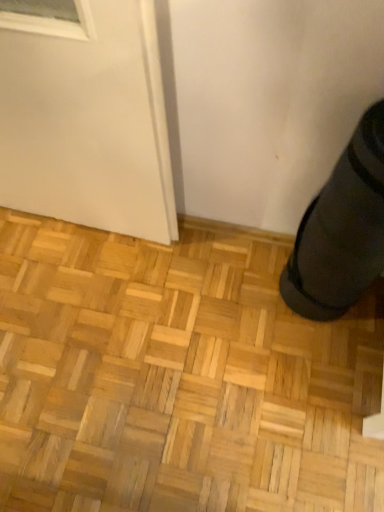
This screenshot has width=384, height=512. Describe the element at coordinates (341, 230) in the screenshot. I see `black rubber shoe at lower right` at that location.

Image resolution: width=384 pixels, height=512 pixels. Identify the location of black rubber shoe at lower right. (341, 230).

Locate an element on the screen. The width and height of the screenshot is (384, 512). natural wood parquet floor at lower right is located at coordinates (178, 377).

Measure the distance between point [130,278] and camera.

They are 1.26 meters apart.

This screenshot has height=512, width=384. What do you see at coordinates (178, 377) in the screenshot? I see `natural wood parquet floor at lower right` at bounding box center [178, 377].

The width and height of the screenshot is (384, 512). I want to click on black rubber shoe at lower right, so click(341, 230).

Consider the image. Is natural wood parquet floor at lower right at the right side of black rubber shoe at lower right?

In fact, natural wood parquet floor at lower right is to the left of black rubber shoe at lower right.

Considering the positions of objects natural wood parquet floor at lower right and black rubber shoe at lower right in the image provided, who is in front, natural wood parquet floor at lower right or black rubber shoe at lower right?

black rubber shoe at lower right is closer to the camera.

Is point (316, 343) in front of point (324, 256)?

No, it is not.

From the image's perspective, between natural wood parquet floor at lower right and black rubber shoe at lower right, who is located below?

natural wood parquet floor at lower right is shown below in the image.

From a real-world perspective, who is located higher, natural wood parquet floor at lower right or black rubber shoe at lower right?

In real-world perspective, black rubber shoe at lower right is above.

Between natural wood parquet floor at lower right and black rubber shoe at lower right, which one has smaller width?

black rubber shoe at lower right is thinner.

Is natural wood parquet floor at lower right taller than black rubber shoe at lower right?

Incorrect, the height of natural wood parquet floor at lower right is not larger of that of black rubber shoe at lower right.

Can you confirm if natural wood parquet floor at lower right is smaller than black rubber shoe at lower right?

Incorrect, natural wood parquet floor at lower right is not smaller in size than black rubber shoe at lower right.

Is black rubber shoe at lower right inside natural wood parquet floor at lower right?

Actually, black rubber shoe at lower right is outside natural wood parquet floor at lower right.

Is natural wood parquet floor at lower right next to black rubber shoe at lower right and touching it?

No, natural wood parquet floor at lower right is not with black rubber shoe at lower right.

Is natural wood parquet floor at lower right looking in the opposite direction of black rubber shoe at lower right?

No, natural wood parquet floor at lower right is not facing away from black rubber shoe at lower right.

How different are the orientations of natural wood parquet floor at lower right and black rubber shoe at lower right in degrees?

They differ by 90.1 degrees in their facing directions.

Image resolution: width=384 pixels, height=512 pixels. In order to click on hardwood on the left of black rubber shoe at lower right in this screenshot , I will do `click(178, 377)`.

Considering the relative positions of black rubber shoe at lower right and natural wood parquet floor at lower right in the image provided, is black rubber shoe at lower right to the left of natural wood parquet floor at lower right from the viewer's perspective?

No.

From the picture: Is black rubber shoe at lower right in front of or behind natural wood parquet floor at lower right in the image?

In the image, black rubber shoe at lower right appears in front of natural wood parquet floor at lower right.

Is point (353, 244) positioned before point (235, 286)?

Yes, it is.

From the image's perspective, is black rubber shoe at lower right located beneath natural wood parquet floor at lower right?

No, from the image's perspective, black rubber shoe at lower right is not below natural wood parquet floor at lower right.

From a real-world perspective, which is physically below, black rubber shoe at lower right or natural wood parquet floor at lower right?

natural wood parquet floor at lower right.

Which object is wider, black rubber shoe at lower right or natural wood parquet floor at lower right?

Wider between the two is natural wood parquet floor at lower right.

Is black rubber shoe at lower right shorter than natural wood parquet floor at lower right?

No, black rubber shoe at lower right is not shorter than natural wood parquet floor at lower right.

Is black rubber shoe at lower right bigger or smaller than natural wood parquet floor at lower right?

In the image, black rubber shoe at lower right appears to be smaller than natural wood parquet floor at lower right.

Is black rubber shoe at lower right completely or partially outside of natural wood parquet floor at lower right?

That's correct, black rubber shoe at lower right is outside of natural wood parquet floor at lower right.

Would you consider black rubber shoe at lower right to be distant from natural wood parquet floor at lower right?

black rubber shoe at lower right is actually quite close to natural wood parquet floor at lower right.

Could you tell me if black rubber shoe at lower right is turned towards natural wood parquet floor at lower right?

No.

Looking at this image, measure the distance between black rubber shoe at lower right and natural wood parquet floor at lower right.

The distance of black rubber shoe at lower right from natural wood parquet floor at lower right is 15.14 inches.

Locate an element on the screen. The height and width of the screenshot is (512, 384). shoe in front of the natural wood parquet floor at lower right is located at coordinates (341, 230).

In the image, there is a black rubber shoe at lower right. At what (x,y) coordinates should I click in order to perform the action: click on hardwood below it (from the image's perspective). Please return your answer as a coordinate pair (x, y). Looking at the image, I should click on (178, 377).

Where is `shoe on the right of natural wood parquet floor at lower right`? The image size is (384, 512). shoe on the right of natural wood parquet floor at lower right is located at coordinates (341, 230).